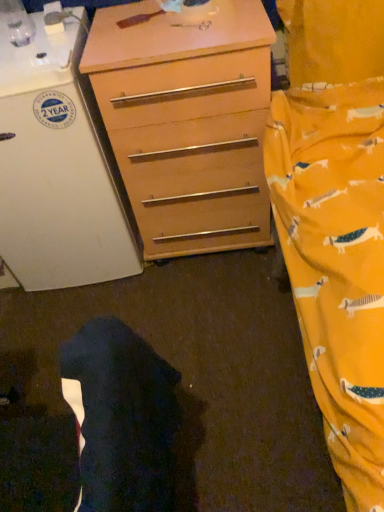
Question: Does dark fabric robe at lower left have a lesser height compared to wooden chest of drawers at center?

Choices:
 (A) yes
 (B) no

Answer: (A)

Question: Are dark fabric robe at lower left and wooden chest of drawers at center located far from each other?

Choices:
 (A) no
 (B) yes

Answer: (A)

Question: Considering the relative sizes of dark fabric robe at lower left and wooden chest of drawers at center in the image provided, is dark fabric robe at lower left taller than wooden chest of drawers at center?

Choices:
 (A) no
 (B) yes

Answer: (A)

Question: From a real-world perspective, is dark fabric robe at lower left on top of wooden chest of drawers at center?

Choices:
 (A) yes
 (B) no

Answer: (A)

Question: Is dark fabric robe at lower left not within wooden chest of drawers at center?

Choices:
 (A) no
 (B) yes

Answer: (B)

Question: Is dark fabric robe at lower left turned away from wooden chest of drawers at center?

Choices:
 (A) no
 (B) yes

Answer: (A)

Question: Is white matte refrigerator at left at the back of dark fabric robe at lower left?

Choices:
 (A) yes
 (B) no

Answer: (B)

Question: Is dark fabric robe at lower left thinner than white matte refrigerator at left?

Choices:
 (A) yes
 (B) no

Answer: (A)

Question: Is dark fabric robe at lower left oriented towards white matte refrigerator at left?

Choices:
 (A) yes
 (B) no

Answer: (B)

Question: From a real-world perspective, is dark fabric robe at lower left positioned over white matte refrigerator at left based on gravity?

Choices:
 (A) no
 (B) yes

Answer: (B)

Question: From a real-world perspective, is dark fabric robe at lower left below white matte refrigerator at left?

Choices:
 (A) no
 (B) yes

Answer: (A)

Question: Is dark fabric robe at lower left further to camera compared to white matte refrigerator at left?

Choices:
 (A) no
 (B) yes

Answer: (A)

Question: Considering the relative sizes of wooden chest of drawers at center and white matte refrigerator at left in the image provided, is wooden chest of drawers at center bigger than white matte refrigerator at left?

Choices:
 (A) no
 (B) yes

Answer: (A)